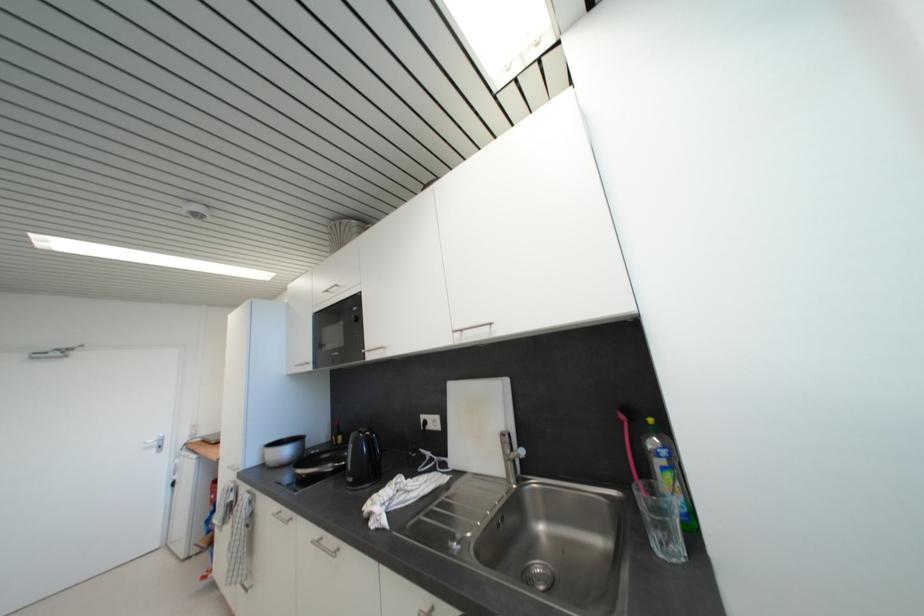
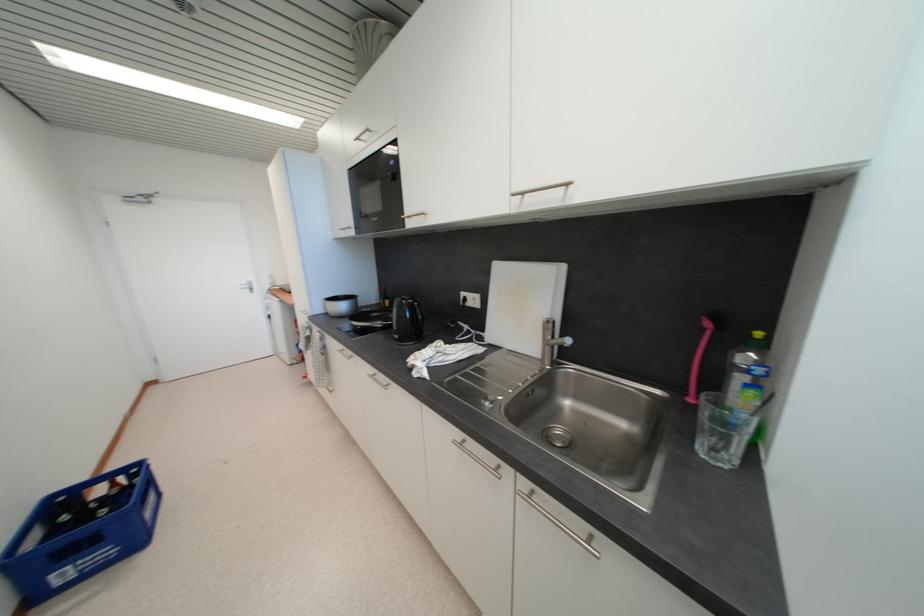
Locate, in the second image, the point that corresponds to point 357,483 in the first image.

(402, 339)